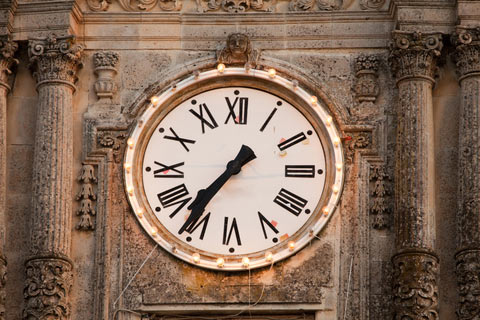
This screenshot has height=320, width=480. I want to click on burned out light top right of xii, so click(248, 61).